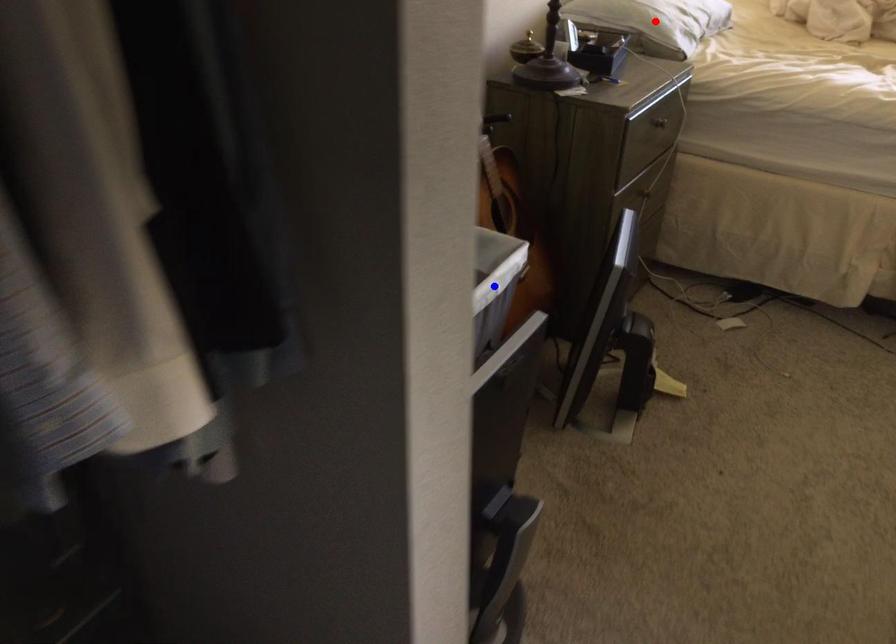
Question: Two points are marked on the image. Which point is closer to the camera?

Choices:
 (A) Blue point is closer.
 (B) Red point is closer.

Answer: (A)